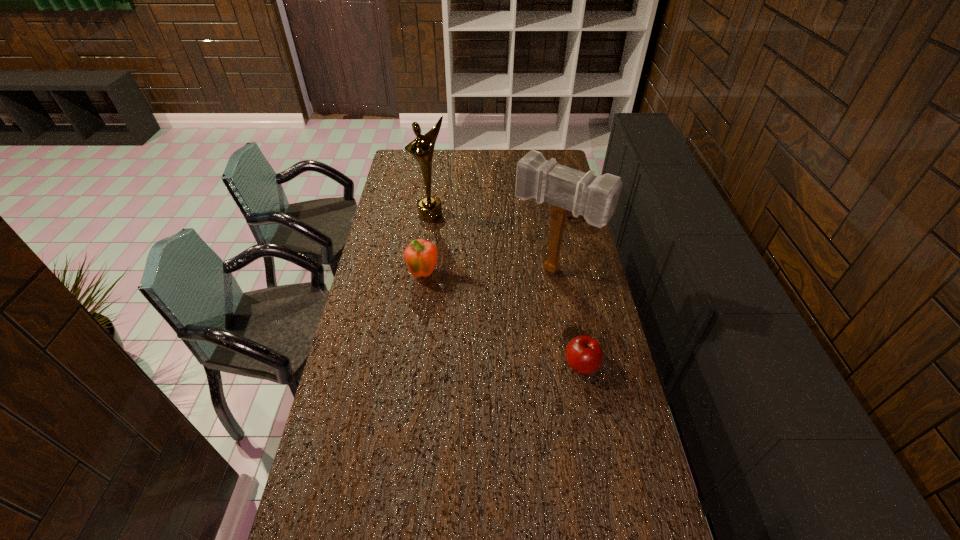
The width and height of the screenshot is (960, 540). In order to click on the third shortest object in this screenshot , I will do `click(421, 256)`.

The width and height of the screenshot is (960, 540). Identify the location of the nearest object. (584, 355).

Find the location of a particular element. The image size is (960, 540). apple is located at coordinates (584, 355).

At what (x,y) coordinates should I click in order to perform the action: click on cup. Please return your answer as a coordinate pair (x, y). This screenshot has width=960, height=540. Looking at the image, I should click on (570, 214).

You are a GUI agent. You are given a task and a screenshot of the screen. Output one action in this format:
    pyautogui.click(x=<x>, y=<y>)
    Task: Click on the award
    The height and width of the screenshot is (540, 960).
    Given the screenshot: What is the action you would take?
    pyautogui.click(x=421, y=148)

Locate an element on the screen. The height and width of the screenshot is (540, 960). mallet is located at coordinates (594, 197).

Locate an element on the screen. vacant space situated 0.330m on the right of the third tallest object is located at coordinates (523, 275).

Locate an element on the screen. Image resolution: width=960 pixels, height=540 pixels. free space located on the back of the apple is located at coordinates (571, 313).

Locate an element on the screen. Image resolution: width=960 pixels, height=540 pixels. vacant space located on the side with the handle of the fourth tallest object is located at coordinates (554, 231).

Locate an element on the screen. The width and height of the screenshot is (960, 540). free spot located on the side with the handle of the fourth tallest object is located at coordinates (540, 246).